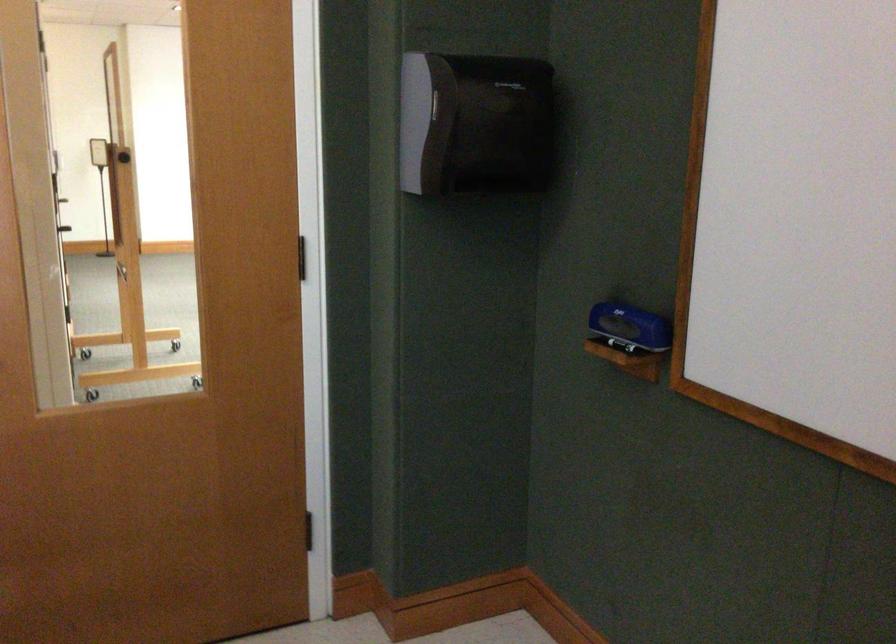
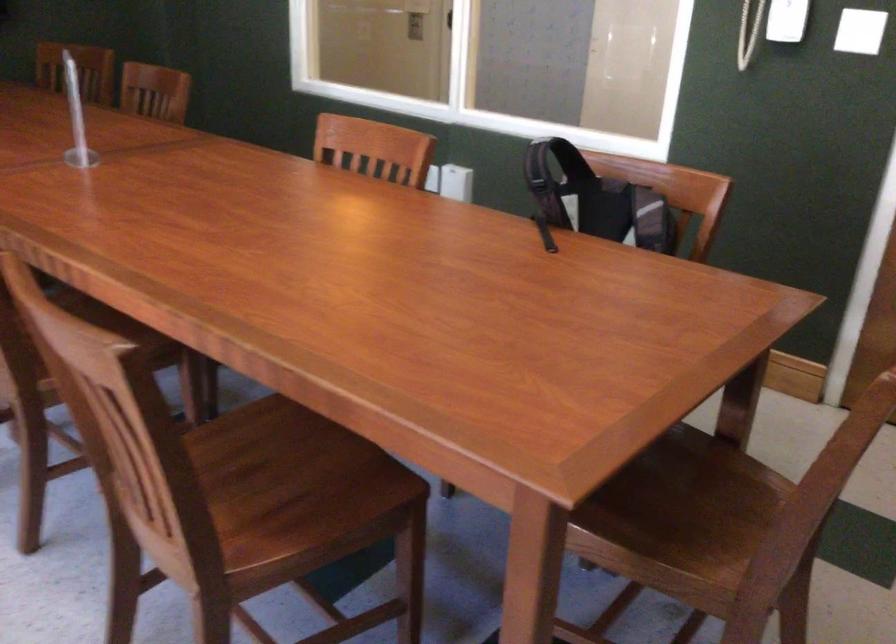
The images are taken continuously from a first-person perspective. In which direction is your viewpoint rotating?

The camera rotated toward left-down.